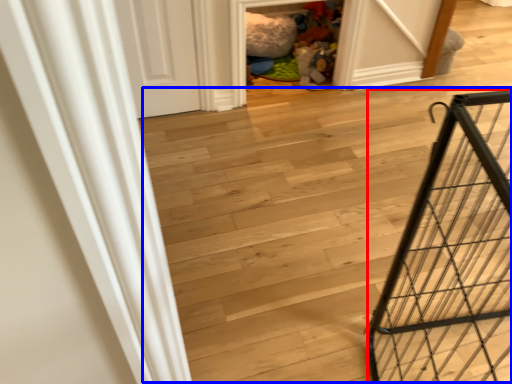
Question: Which object is closer to the camera taking this photo, cage (highlighted by a red box) or stairwell (highlighted by a blue box)?

Choices:
 (A) cage
 (B) stairwell

Answer: (A)